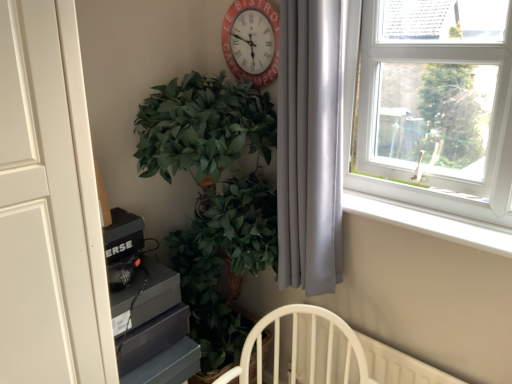
Question: Is point (236, 39) positioned closer to the camera than point (400, 218)?

Choices:
 (A) farther
 (B) closer

Answer: (A)

Question: Is red painted wood clock at upper center in front of or behind white plastic window sill at upper right in the image?

Choices:
 (A) front
 (B) behind

Answer: (B)

Question: Which is farther from the white plastic window sill at upper right?

Choices:
 (A) green leafy plant at center-left
 (B) white plastic window at upper right
 (C) red painted wood clock at upper center
 (D) silky gray curtain at right

Answer: (C)

Question: Which of these objects is positioned farthest from the red painted wood clock at upper center?

Choices:
 (A) white plastic window at upper right
 (B) green leafy plant at center-left
 (C) white plastic window sill at upper right
 (D) silky gray curtain at right

Answer: (C)